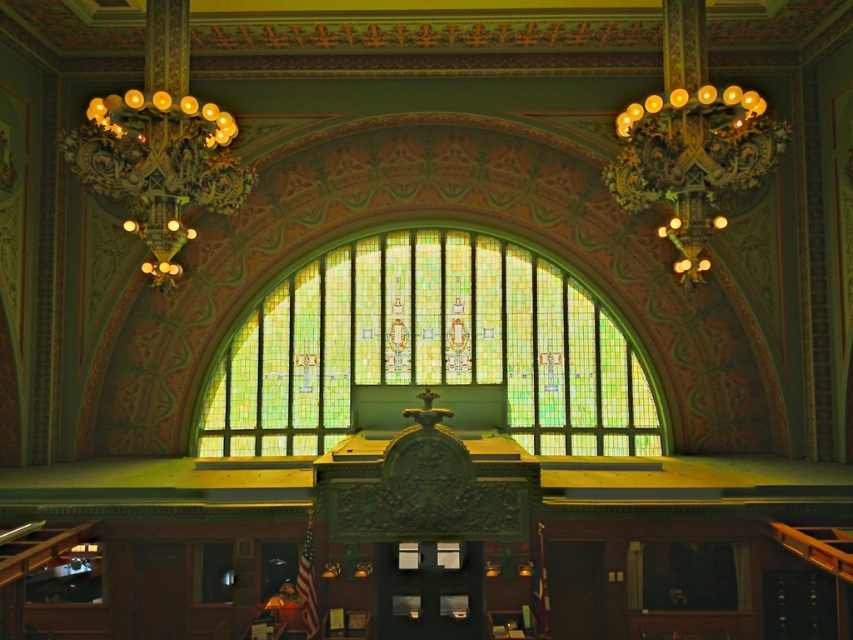
You are a maintenance worker needing to clean both the stained glass window at center and the gold metallic chandelier at upper left. You have a ladder that can reach up to 12 meters. Can you safely clean both objects with the ladder you have?

The distance between the stained glass window at center and the gold metallic chandelier at upper left is 14.77 meters, which exceeds the ladder length of 12 meters. Thus, you cannot safely clean both objects with the ladder you have.

You are standing in the grand building and want to move from point (x=379, y=362) to point (x=706, y=164). Which direction should you move to get closer to your destination?

You should move away from the viewer since point (x=379, y=362) is closer to you than point (x=706, y=164).

You are an interior designer assessing the space. The stained glass window at center and the gold metallic chandelier at upper right are both central to the room. Which object is taller?

The stained glass window at center is taller than the gold metallic chandelier at upper right according to the description.